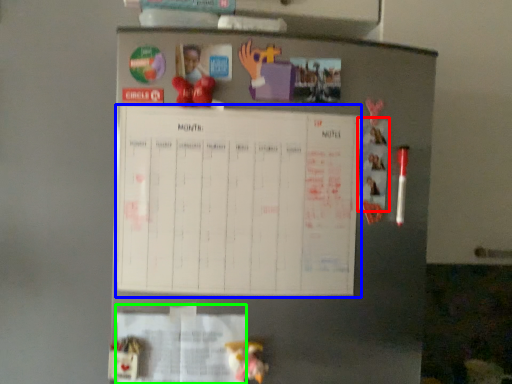
Question: Which object is the closest to the poster (highlighted by a red box)? Choose among these: bulletin board (highlighted by a blue box) or paper (highlighted by a green box).

Choices:
 (A) bulletin board
 (B) paper

Answer: (A)